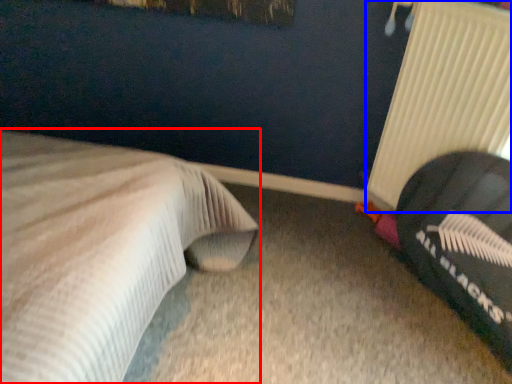
Question: Among these objects, which one is nearest to the camera, bed (highlighted by a red box) or radiator (highlighted by a blue box)?

Choices:
 (A) bed
 (B) radiator

Answer: (A)